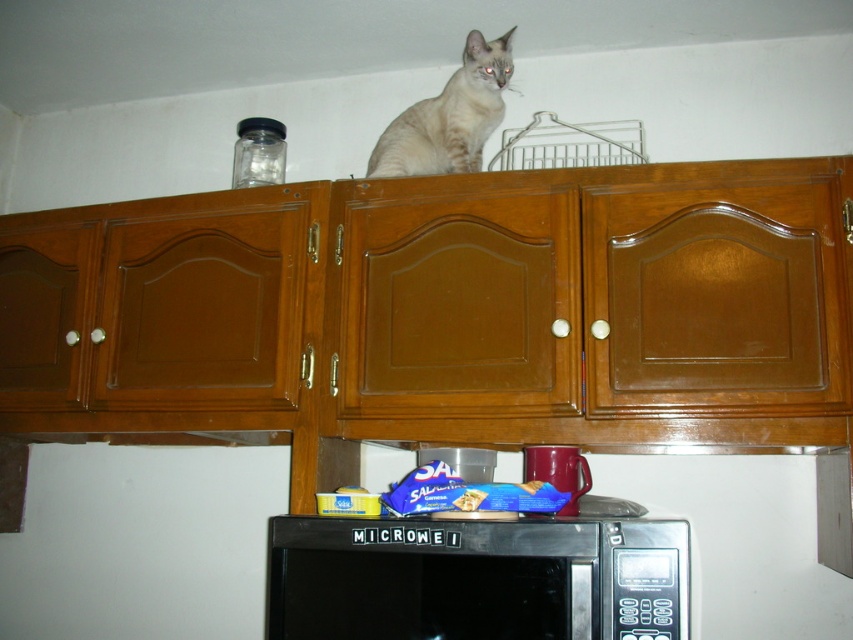
You are a chef trying to place a 12 inch wide baking dish on the available surfaces in the kitchen. The wooden at upper center and the black matte microwave at lower center are the only options. Which surface can accommodate the dish based on their widths?

The wooden at upper center has a lesser width compared to the black matte microwave at lower center. Since the baking dish is 12 inches wide, the black matte microwave at lower center is wider and can accommodate the dish.

You are standing in the kitchen and want to reach the point marked at coordinates (566, 282). Given that your arm can extend 1.2 meters, can you reach that point without moving closer?

The distance between you and the point (566, 282) is 1.31 meters. Since your arm can only extend 1.2 meters, you cannot reach it without moving closer.